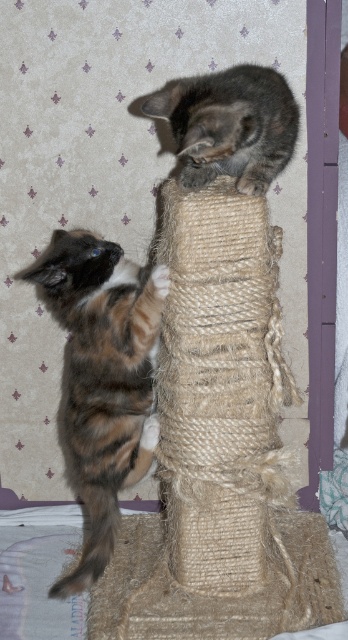
Question: Among these points, which one is nearest to the camera?

Choices:
 (A) (62, 291)
 (B) (258, 138)

Answer: (B)

Question: Is calico fur cat at left above gray textured cat at upper center?

Choices:
 (A) yes
 (B) no

Answer: (B)

Question: Can you confirm if calico fur cat at left is thinner than gray textured cat at upper center?

Choices:
 (A) yes
 (B) no

Answer: (A)

Question: Which point is closer to the camera?

Choices:
 (A) (257, 154)
 (B) (145, 369)

Answer: (A)

Question: Does calico fur cat at left appear on the left side of gray textured cat at upper center?

Choices:
 (A) yes
 (B) no

Answer: (A)